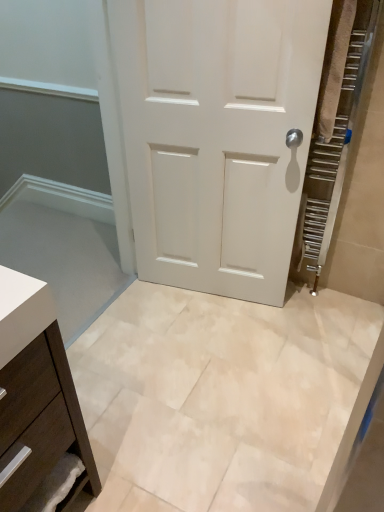
Locate an element on the screen. vacant region to the left of white matte door at center is located at coordinates (147, 319).